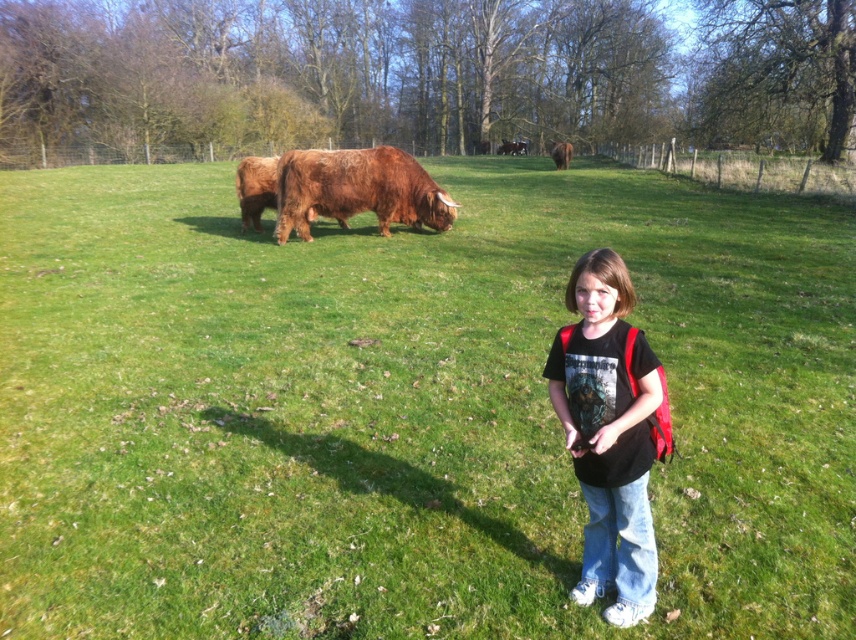
In the scene shown: You are standing at the point labeled as point (241, 208) in the image. You want to take a photo of the entire scene. If the camera is 15.28 meters away from you, what is the minimum distance you need to walk towards the camera to ensure the entire scene fits in the frame?

You need to walk 15.28 meters towards the camera to ensure the entire scene fits in the frame.

You are a photographer trying to capture a group photo of the black matte shirt at center and the brown fuzzy yak at upper center. If you want to ensure both subjects are in focus, which one should you focus on first to account for their sizes?

The black matte shirt at center has a smaller size compared to the brown fuzzy yak at upper center, so you should focus on the brown fuzzy yak at upper center first since it is larger and may require more precise focusing to ensure clarity.